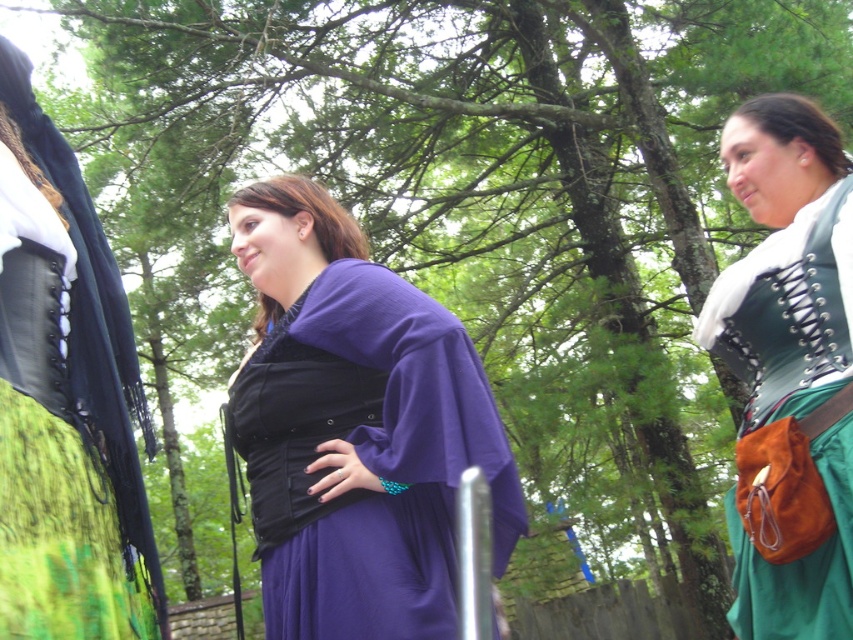
You are an event organizer trying to arrange the participants for a group photo. You need to position the purple velvet dress at center and the purple matte dress at center so that both are visible. Based on their current positions, which one should you move forward to ensure both are visible in the photo?

The purple velvet dress at center is already in front of the purple matte dress at center. To ensure both are visible, you should move the purple matte dress at center forward so it is in front of the purple velvet dress at center.

What are the coordinates of the purple velvet dress at center?

The purple velvet dress at center is located at coordinates point (65, 400).

Based on the scene description, which dress is positioned lower on the image between the purple velvet dress at center and the purple matte dress at center?

The purple velvet dress at center is positioned lower than the purple matte dress at center in the image.